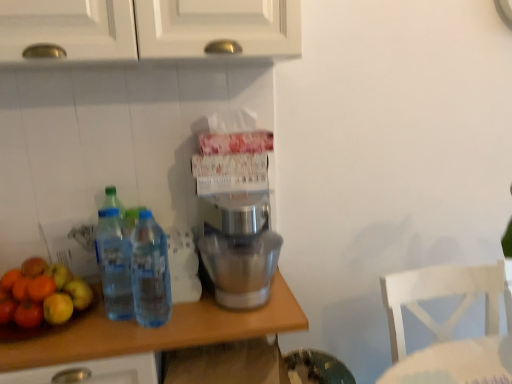
This screenshot has width=512, height=384. Find the location of `vacant area situated to the left side of clear plastic bottles at center, the first bottle in the right-to-left sequence`. vacant area situated to the left side of clear plastic bottles at center, the first bottle in the right-to-left sequence is located at coordinates (100, 333).